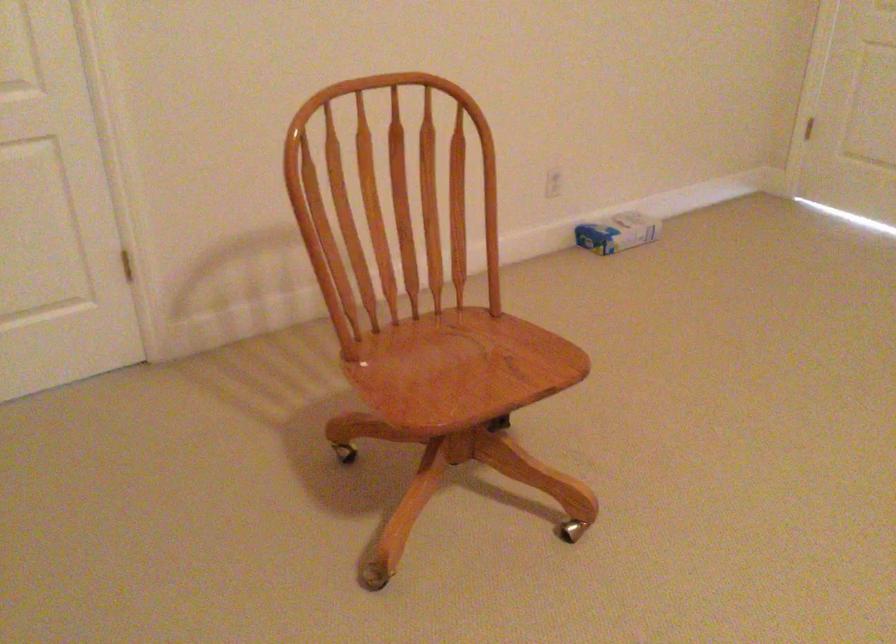
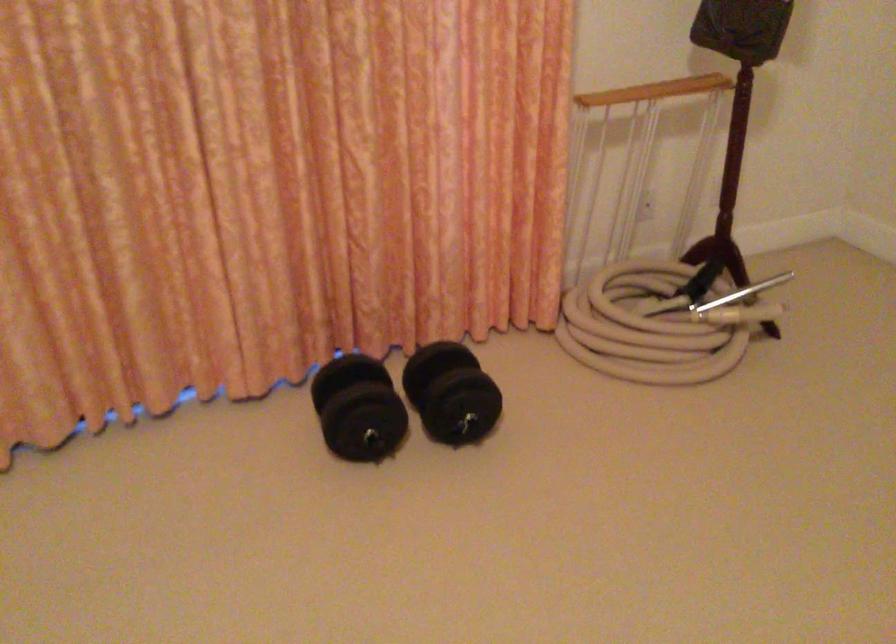
From the picture: First-person continuous shooting, in which direction is the camera rotating?

The rotation direction of the camera is left-down.